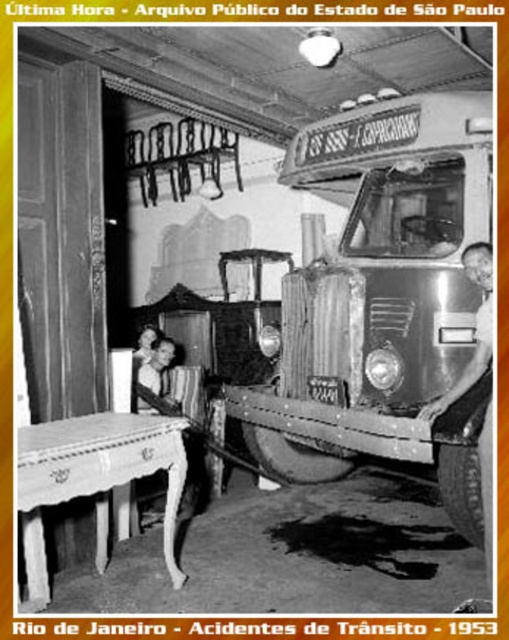
Question: Does shiny silver fire truck at center have a lesser width compared to smooth skin woman at center?

Choices:
 (A) yes
 (B) no

Answer: (B)

Question: Is shiny silver fire truck at center positioned in front of smooth skin woman at center?

Choices:
 (A) yes
 (B) no

Answer: (A)

Question: Estimate the real-world distances between objects in this image. Which object is farther from the shiny silver fire truck at center?

Choices:
 (A) white wood table at lower left
 (B) shiny silver truck at right
 (C) smooth skin woman at center

Answer: (C)

Question: Estimate the real-world distances between objects in this image. Which object is closer to the smooth skin woman at center?

Choices:
 (A) shiny silver fire truck at center
 (B) white wood table at lower left

Answer: (B)

Question: Is shiny silver fire truck at center above shiny silver truck at right?

Choices:
 (A) no
 (B) yes

Answer: (B)

Question: Among these objects, which one is farthest from the camera?

Choices:
 (A) shiny silver truck at right
 (B) white wood table at lower left
 (C) shiny silver fire truck at center
 (D) smooth skin woman at center

Answer: (D)